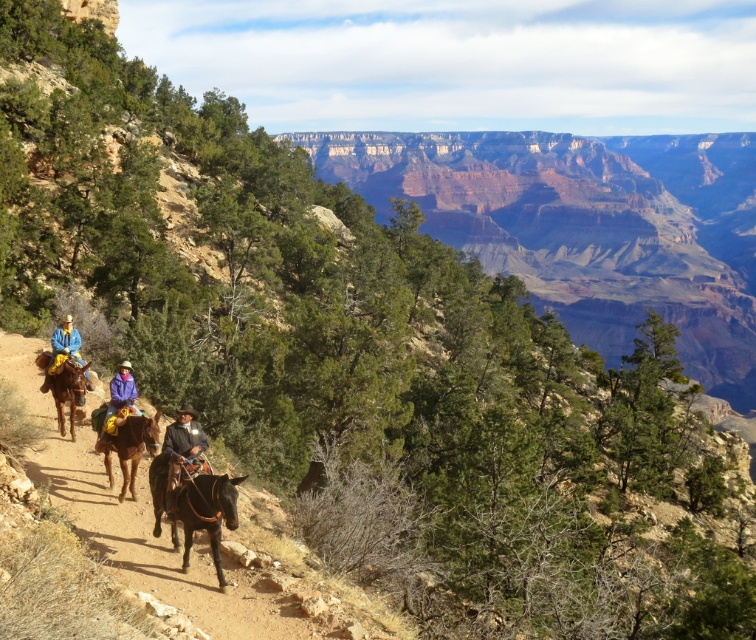
Is brown fuzzy horse at center further to camera compared to matte blue shirt at center?

No, brown fuzzy horse at center is closer to the viewer.

Can you confirm if brown fuzzy horse at center is positioned below matte blue shirt at center?

Yes.

The height and width of the screenshot is (640, 756). Describe the element at coordinates (129, 449) in the screenshot. I see `brown fuzzy horse at center` at that location.

The height and width of the screenshot is (640, 756). What are the coordinates of `brown fuzzy horse at center` in the screenshot? It's located at (129, 449).

Between brown fuzzy horse at center and purple fleece jacket at center, which one is positioned lower?

brown fuzzy horse at center is below.

Does point (152, 417) lie in front of point (119, 362)?

Yes, it is.

Who is more forward, (146, 433) or (135, 404)?

Point (146, 433) is in front.

You are a GUI agent. You are given a task and a screenshot of the screen. Output one action in this format:
    pyautogui.click(x=<x>, y=<y>)
    Task: Click on the brown fuzzy horse at center
    This screenshot has height=640, width=756.
    Given the screenshot: What is the action you would take?
    pyautogui.click(x=129, y=449)

Does shiny brown horse at center appear on the left side of brown leather saddle at left?

In fact, shiny brown horse at center is to the right of brown leather saddle at left.

The width and height of the screenshot is (756, 640). Find the location of `shiny brown horse at center`. shiny brown horse at center is located at coordinates (205, 513).

At what (x,y) coordinates should I click in order to perform the action: click on shiny brown horse at center. Please return your answer as a coordinate pair (x, y). Looking at the image, I should click on [205, 513].